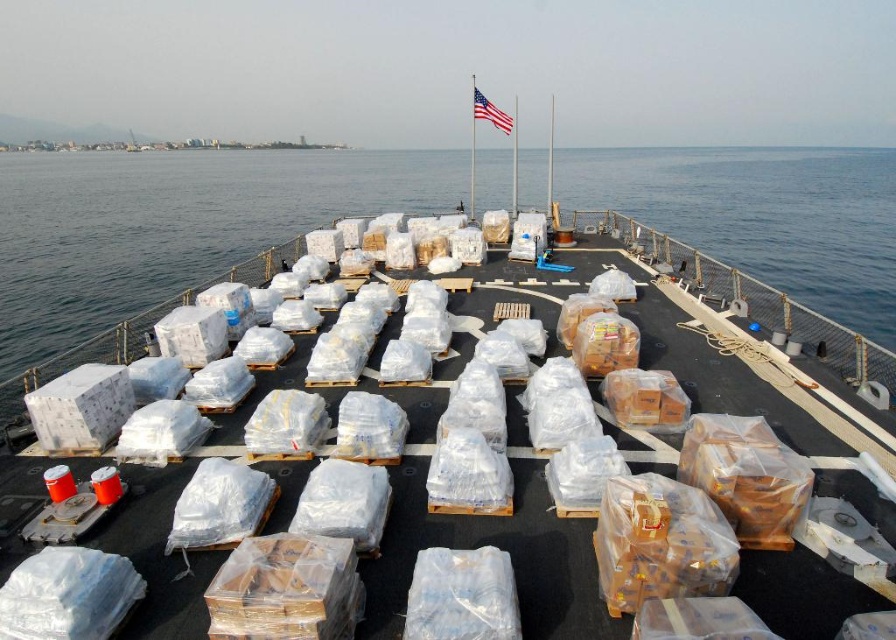
What do you see at coordinates (717, 346) in the screenshot?
I see `clear plastic packages at center` at bounding box center [717, 346].

This screenshot has width=896, height=640. What are the coordinates of `clear plastic packages at center` in the screenshot? It's located at (717, 346).

This screenshot has height=640, width=896. Identify the location of clear plastic packages at center. (717, 346).

Between clear plastic packages at center and transparent plastic pallets at center, which one appears on the left side from the viewer's perspective?

From the viewer's perspective, transparent plastic pallets at center appears more on the left side.

Where is `clear plastic packages at center`? This screenshot has height=640, width=896. clear plastic packages at center is located at coordinates (717, 346).

Describe the element at coordinates (717, 346) in the screenshot. I see `clear plastic packages at center` at that location.

Image resolution: width=896 pixels, height=640 pixels. I want to click on clear plastic packages at center, so click(x=717, y=346).

Does transparent plastic pallets at center appear over american flag at center?

Correct, transparent plastic pallets at center is located above american flag at center.

Is transparent plastic pallets at center shorter than american flag at center?

No.

The image size is (896, 640). I want to click on transparent plastic pallets at center, so click(171, 225).